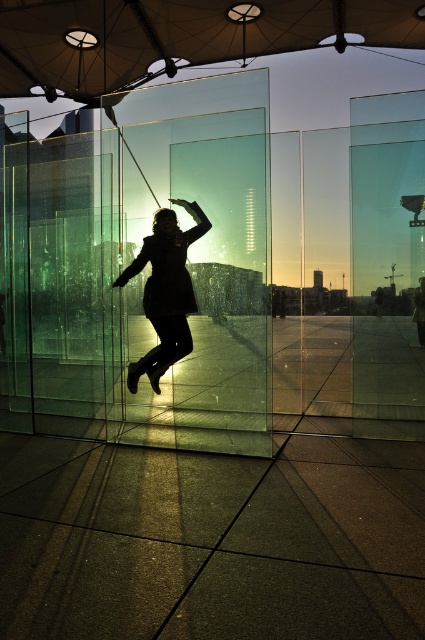
Can you confirm if transparent fabric umbrella at upper center is positioned to the left of black matte coat at center?

Correct, you'll find transparent fabric umbrella at upper center to the left of black matte coat at center.

Can you confirm if transparent fabric umbrella at upper center is shorter than black matte coat at center?

Incorrect, transparent fabric umbrella at upper center's height does not fall short of black matte coat at center's.

Who is more distant from viewer, (99,76) or (155,362)?

Positioned behind is point (99,76).

This screenshot has width=425, height=640. In order to click on transparent fabric umbrella at upper center in this screenshot , I will do `click(176, 36)`.